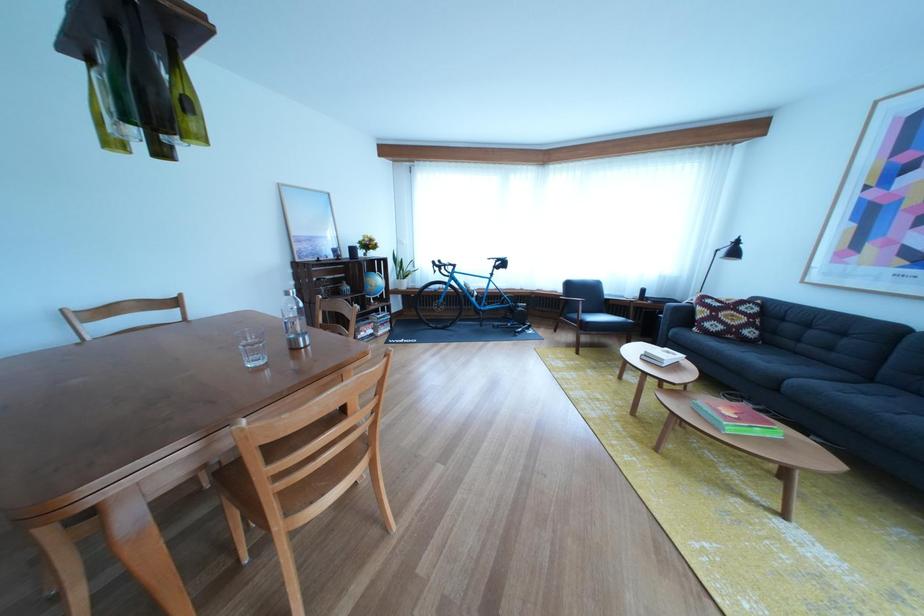
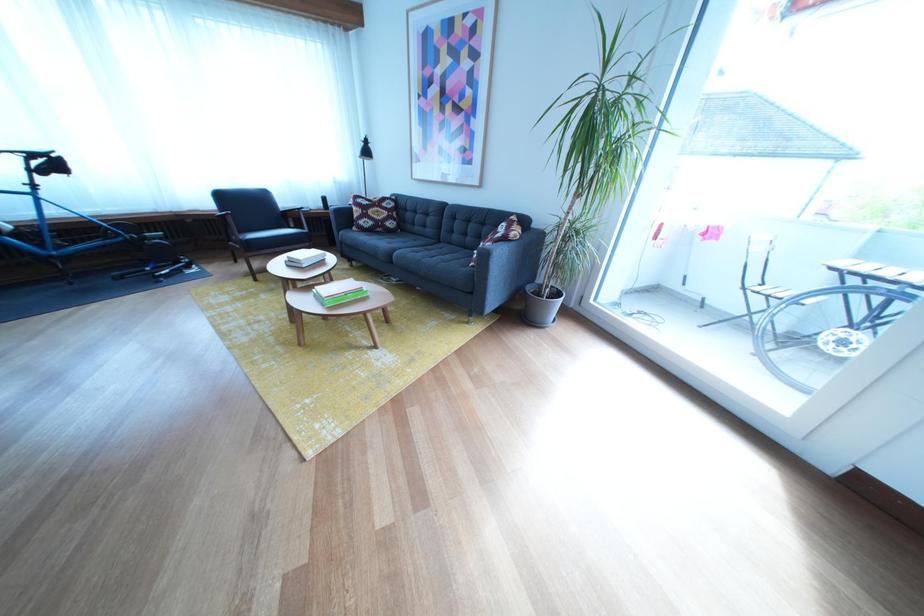
The point at (738, 322) is marked in the first image. Where is the corresponding point in the second image?

(386, 219)